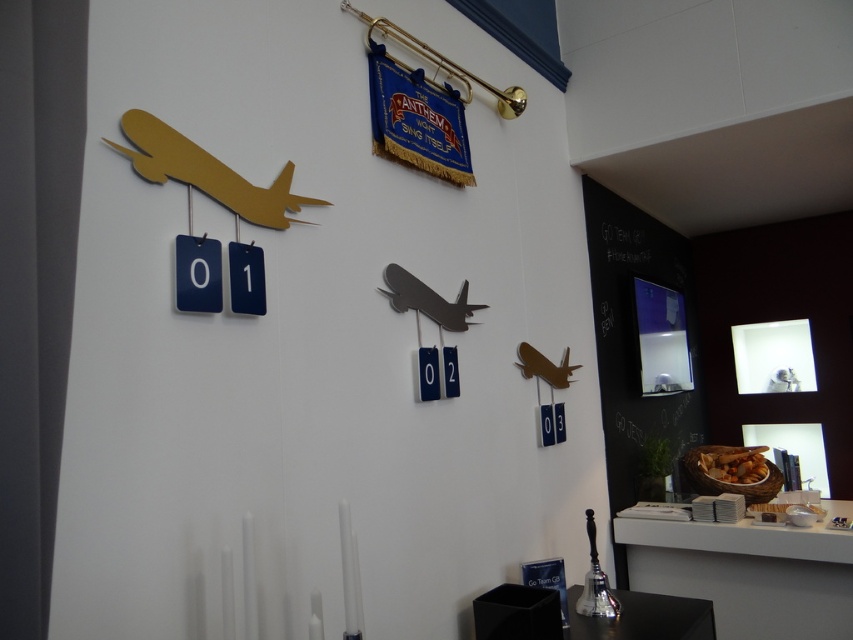
You are an interior designer arranging a modern room. You have two airplanes displayed on the wall, the gold matte airplane at upper left and the metallic gold airplane at center. Which airplane is positioned closer to the observer?

The gold matte airplane at upper left is closer to the observer than the metallic gold airplane at center.

You are an interior designer planning to hang a new decorative item between the gold matte airplane at upper left and the matte black airplane at center. The item requires 16 inches of space. Is there enough space between them?

The gold matte airplane at upper left and the matte black airplane at center are 18.44 inches apart, which is more than the required 16 inches. Therefore, there is enough space to hang the new decorative item between them.

You are an interior designer arranging items on a wall. You have a gold matte airplane at upper left and a matte black airplane at center. Which airplane has a smaller width?

The gold matte airplane at upper left has a smaller width than the matte black airplane at center.